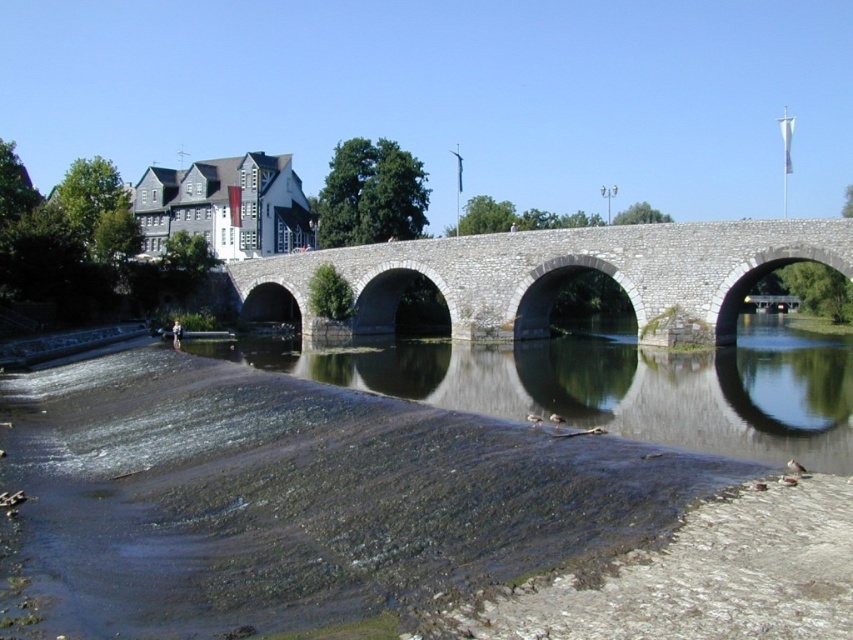
You are standing at the point labeled as point (x=392, y=515) in the image. Based on the scene description, what is the immediate surface you are standing on?

The point (x=392, y=515) is on brown stone river at center, so you are standing on the brown stone river at center.

You are a tourist standing on the gray stone bridge at center and looking down. You notice the brown stone river at center below. Which structure is taller from your perspective?

The gray stone bridge at center is taller than the brown stone river at center because the river is below the bridge and the description states that the river is not as tall as the bridge.

You are standing on the gray stone bridge at center and want to cross to the other side. Which direction should you walk to avoid the brown stone river at center?

You should walk to the right side of the gray stone bridge at center because the brown stone river at center is on the left side, so moving right will take you away from the river towards the opposite bank.